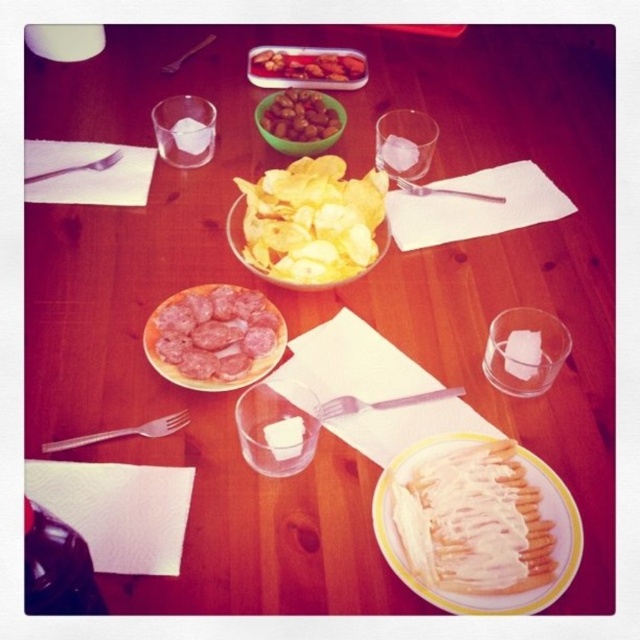
You are a person with a 10 inch long arm. You want to pick up the pink plastic fork at center and the silver metallic fork at upper center from the table. Can you reach both forks without moving your arm?

The distance between the pink plastic fork at center and the silver metallic fork at upper center is 12.65 inches. Since your arm is only 10 inches long, you cannot reach both forks without moving your arm.

You are at a picnic and have both the pink plastic fork at center and the silver metallic fork at upper center. Which fork should you choose if you need a larger fork to eat your salad?

The pink plastic fork at center is larger in size than the silver metallic fork at upper center, so you should choose the pink plastic fork at center for your salad.

You are a person with a 6.5 inch long hand. You want to pick up both the shiny brown nuts at center and the silver metallic fork at upper center at the same time. Can you reach both items without moving your hand?

The shiny brown nuts at center and silver metallic fork at upper center are 6.75 inches apart. Since your hand is 6.5 inches long, you cannot reach both items at the same time without moving your hand.